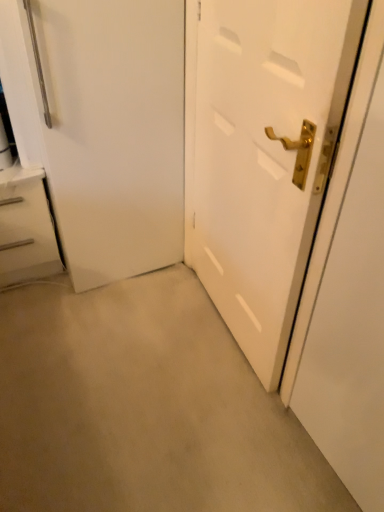
Question: Is white glossy chest of drawers at left wider than white matte door at center?

Choices:
 (A) yes
 (B) no

Answer: (A)

Question: From a real-world perspective, is white glossy chest of drawers at left physically below white matte door at center?

Choices:
 (A) no
 (B) yes

Answer: (B)

Question: Considering the relative positions of white glossy chest of drawers at left and white matte door at center in the image provided, is white glossy chest of drawers at left to the left of white matte door at center from the viewer's perspective?

Choices:
 (A) yes
 (B) no

Answer: (A)

Question: Is white glossy chest of drawers at left smaller than white matte door at center?

Choices:
 (A) yes
 (B) no

Answer: (B)

Question: Could you tell me if white glossy chest of drawers at left is facing white matte door at center?

Choices:
 (A) no
 (B) yes

Answer: (A)

Question: In terms of height, does white glossy door handle at right look taller or shorter compared to white glossy chest of drawers at left?

Choices:
 (A) tall
 (B) short

Answer: (A)

Question: In the image, is white glossy door handle at right on the left side or the right side of white glossy chest of drawers at left?

Choices:
 (A) right
 (B) left

Answer: (A)

Question: Based on their sizes in the image, would you say white glossy door handle at right is bigger or smaller than white glossy chest of drawers at left?

Choices:
 (A) small
 (B) big

Answer: (A)

Question: Is white glossy door handle at right wider or thinner than white glossy chest of drawers at left?

Choices:
 (A) thin
 (B) wide

Answer: (A)

Question: In terms of height, does white glossy door handle at right look taller or shorter compared to white matte door at center?

Choices:
 (A) tall
 (B) short

Answer: (A)

Question: Would you say white glossy door handle at right is to the left or to the right of white matte door at center in the picture?

Choices:
 (A) right
 (B) left

Answer: (A)

Question: Based on their sizes in the image, would you say white glossy door handle at right is bigger or smaller than white matte door at center?

Choices:
 (A) small
 (B) big

Answer: (A)

Question: From a real-world perspective, relative to white matte door at center, is white glossy door handle at right vertically above or below?

Choices:
 (A) above
 (B) below

Answer: (A)

Question: Is point (26, 253) closer or farther from the camera than point (342, 201)?

Choices:
 (A) farther
 (B) closer

Answer: (A)

Question: Is white glossy chest of drawers at left bigger or smaller than white glossy door handle at right?

Choices:
 (A) small
 (B) big

Answer: (B)